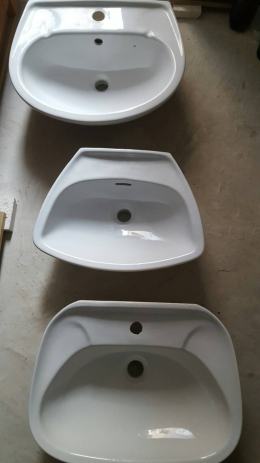
This screenshot has width=260, height=463. I want to click on soap dish, so click(69, 345), click(193, 339), click(36, 16).